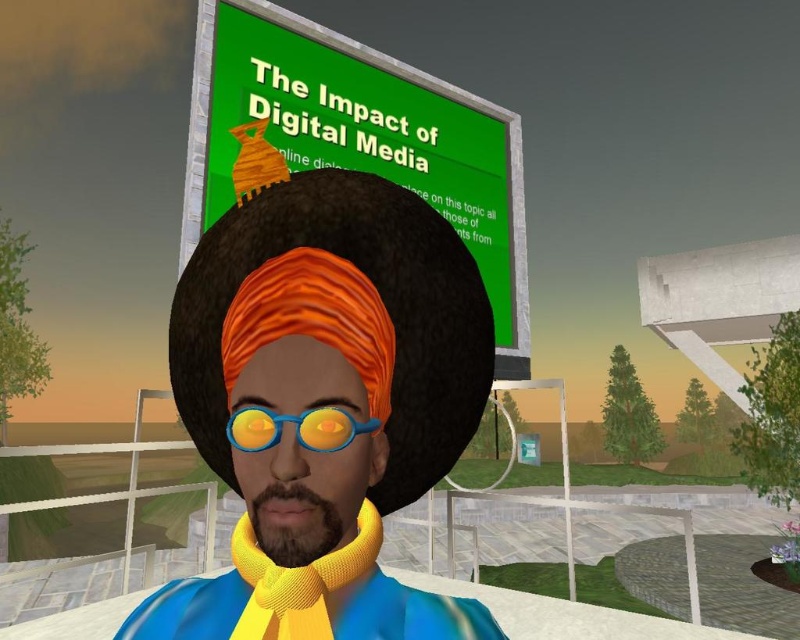
You are a fashion designer analyzing the image. You need to determine which scarf is more suitable for a winter collection. The yellow matte scarf at center and the yellow knitted scarf at center are both present. Which one is larger and thus better for warmth?

The yellow matte scarf at center is bigger than the yellow knitted scarf at center, making it more suitable for a winter collection due to its larger size providing better warmth.

You are standing in front of the billboard and want to touch the point at coordinates [150,604] on the billboard. If your hand can reach up to 50 centimeters, will you be able to reach it?

The point at coordinates [150,604] is 48.11 centimeters away from the viewer, so yes, your hand can reach it since it is within the 50 centimeter limit.